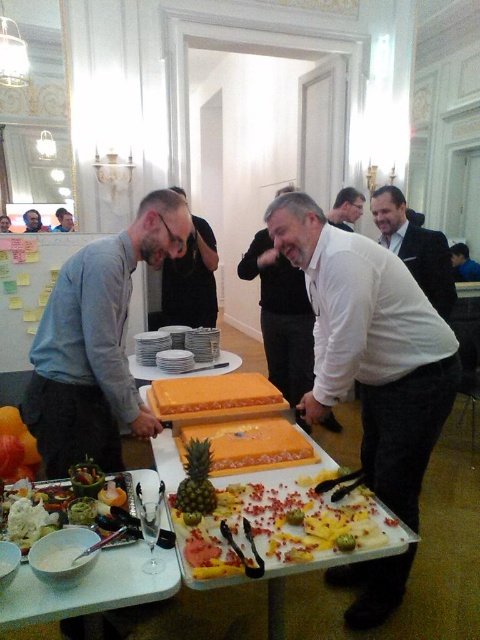
Question: Which point is farther to the camera?

Choices:
 (A) gray shirt at center
 (B) gray fabric shirt at center
 (C) white matte pineapple at center

Answer: (A)

Question: Observing the image, what is the correct spatial positioning of white glossy bowl at lower left in reference to gray shirt at center?

Choices:
 (A) left
 (B) right

Answer: (B)

Question: Among these objects, which one is farthest from the camera?

Choices:
 (A) smooth white shirt at center
 (B) white glossy bowl at lower left
 (C) orange plastic tray at center

Answer: (A)

Question: Which object is the farthest from the gray fabric shirt at center?

Choices:
 (A) gray shirt at center
 (B) dark suit at center
 (C) white glossy bowl at lower left
 (D) white matte pineapple at center

Answer: (C)

Question: Can you confirm if white matte shirt at center is positioned above white glossy plates at center?

Choices:
 (A) yes
 (B) no

Answer: (B)

Question: Does white matte pineapple at center appear over dark suit at center?

Choices:
 (A) no
 (B) yes

Answer: (A)